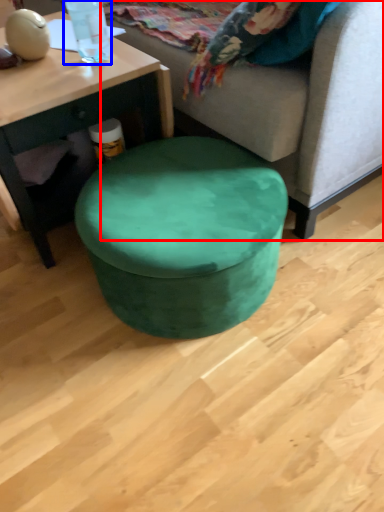
Question: Which of the following is the farthest to the observer, studio couch (highlighted by a red box) or bottle (highlighted by a blue box)?

Choices:
 (A) studio couch
 (B) bottle

Answer: (B)